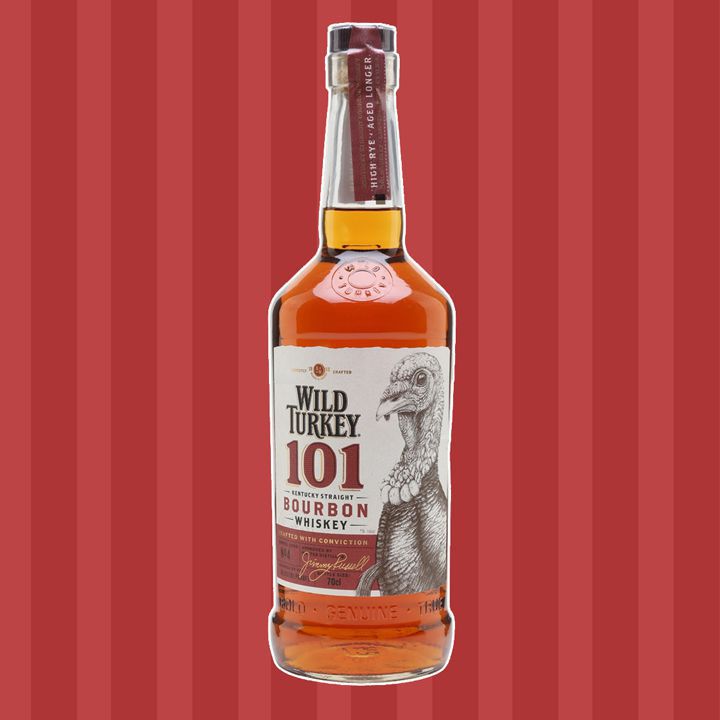
At what (x,y) coordinates should I click in order to perform the action: click on label on bottle. Please return your answer as a coordinate pair (x, y). The image size is (720, 720). Looking at the image, I should click on (373, 435), (391, 485).